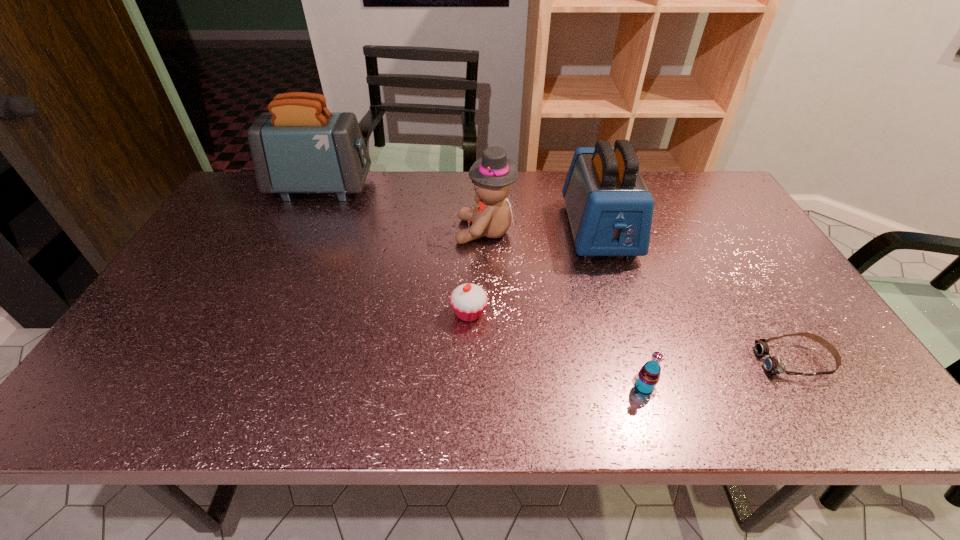
Find the location of `the left toaster`. the left toaster is located at coordinates point(299,146).

At what (x,y) coordinates should I click in order to perform the action: click on the right toaster. Please return your answer as a coordinate pair (x, y). This screenshot has height=540, width=960. Looking at the image, I should click on (610, 209).

Locate an element on the screen. The image size is (960, 540). rag_doll is located at coordinates (492, 175).

Where is `soda`? soda is located at coordinates (645, 381).

What are the coordinates of `the fifth tallest object` in the screenshot? It's located at (468, 301).

Locate an element on the screen. The height and width of the screenshot is (540, 960). the third nearest object is located at coordinates (468, 301).

Where is `goggles`? The image size is (960, 540). goggles is located at coordinates (773, 364).

Where is `the rightmost object`? the rightmost object is located at coordinates (773, 364).

Locate an element on the screen. This screenshot has height=540, width=960. free region located 0.240m on the front-facing side of the leftmost object is located at coordinates (442, 188).

This screenshot has width=960, height=540. In order to click on blank area located 0.100m on the front-facing side of the shorter toaster in this screenshot , I will do `click(619, 292)`.